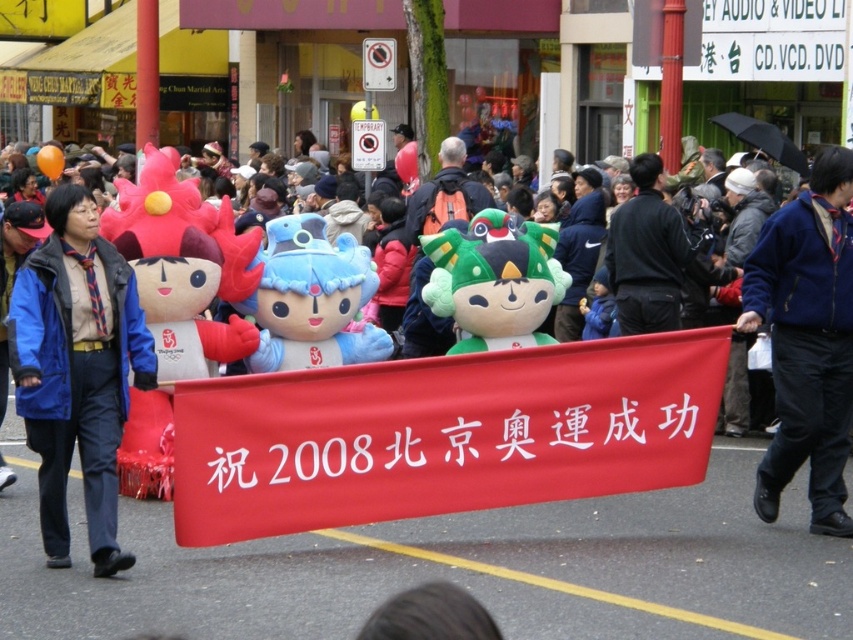
Does blue fleece jacket at left come behind black matte jacket at center?

No, blue fleece jacket at left is closer to the viewer.

How distant is blue fleece jacket at left from black matte jacket at center?

blue fleece jacket at left is 5.53 meters away from black matte jacket at center.

This screenshot has height=640, width=853. In order to click on blue fleece jacket at left in this screenshot , I will do coord(77,371).

Where is `blue fleece jacket at left`? This screenshot has height=640, width=853. blue fleece jacket at left is located at coordinates (77, 371).

Who is lower down, fluffy plush toy at center or green plush toy at center?

fluffy plush toy at center is lower down.

In the scene shown: Is fluffy plush toy at center to the right of green plush toy at center from the viewer's perspective?

In fact, fluffy plush toy at center is to the left of green plush toy at center.

Image resolution: width=853 pixels, height=640 pixels. I want to click on fluffy plush toy at center, so click(x=183, y=266).

Which is above, red fabric banner at center or fluffy plush toy at center?

Positioned higher is fluffy plush toy at center.

Which is behind, point (579, 368) or point (201, 221)?

Positioned behind is point (201, 221).

Is point (317, 424) positioned in front of point (233, 230)?

Yes.

What are the coordinates of `red fabric banner at center` in the screenshot? It's located at (442, 435).